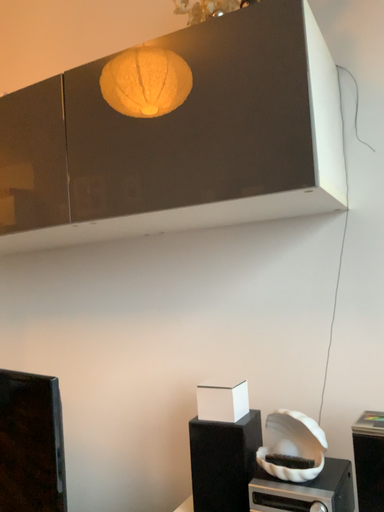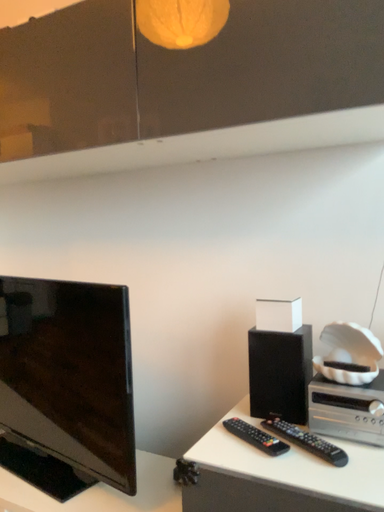
Question: Which way did the camera rotate in the video?

Choices:
 (A) rotated downward
 (B) rotated upward

Answer: (A)